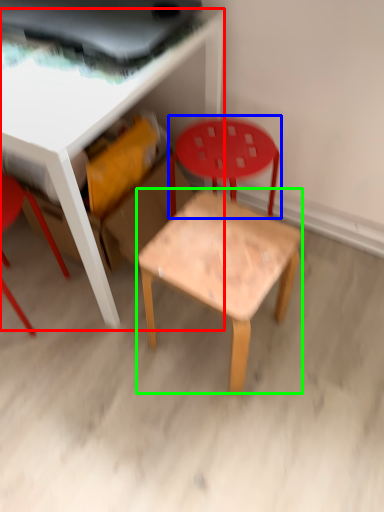
Question: Which is nearer to the table (highlighted by a red box)? chair (highlighted by a blue box) or side table (highlighted by a green box).

Choices:
 (A) chair
 (B) side table

Answer: (A)